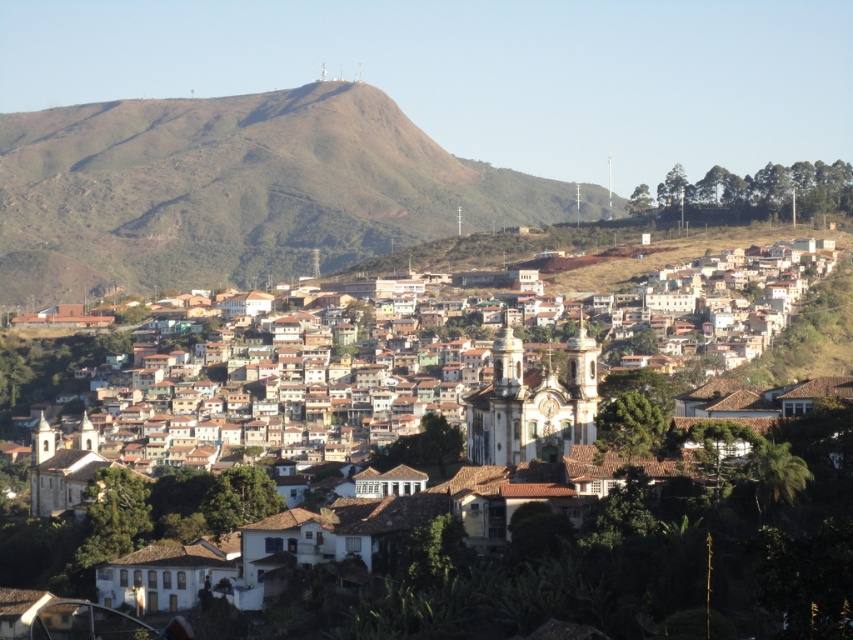
Question: Does brown clay roof tiles at center have a larger size compared to green grassy hill at upper center?

Choices:
 (A) yes
 (B) no

Answer: (B)

Question: Which point is closer to the camera?

Choices:
 (A) click(422, 465)
 (B) click(148, 228)

Answer: (A)

Question: Which point is closer to the camera taking this photo?

Choices:
 (A) (154, 182)
 (B) (200, 481)

Answer: (B)

Question: Can you confirm if brown clay roof tiles at center is smaller than green grassy hill at upper center?

Choices:
 (A) no
 (B) yes

Answer: (B)

Question: Which object appears farthest from the camera in this image?

Choices:
 (A) green grassy hill at upper center
 (B) brown clay roof tiles at center

Answer: (A)

Question: Is brown clay roof tiles at center closer to the viewer compared to green grassy hill at upper center?

Choices:
 (A) no
 (B) yes

Answer: (B)